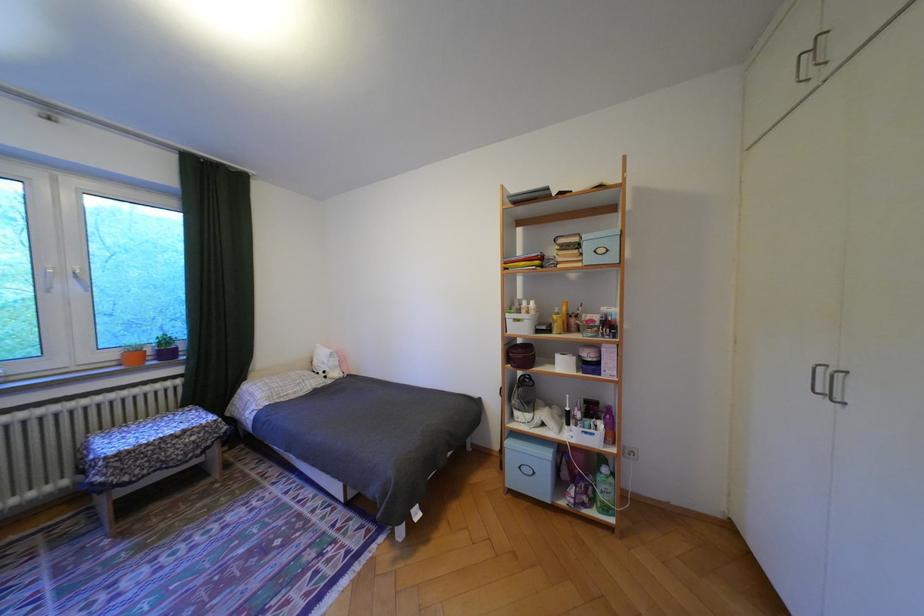
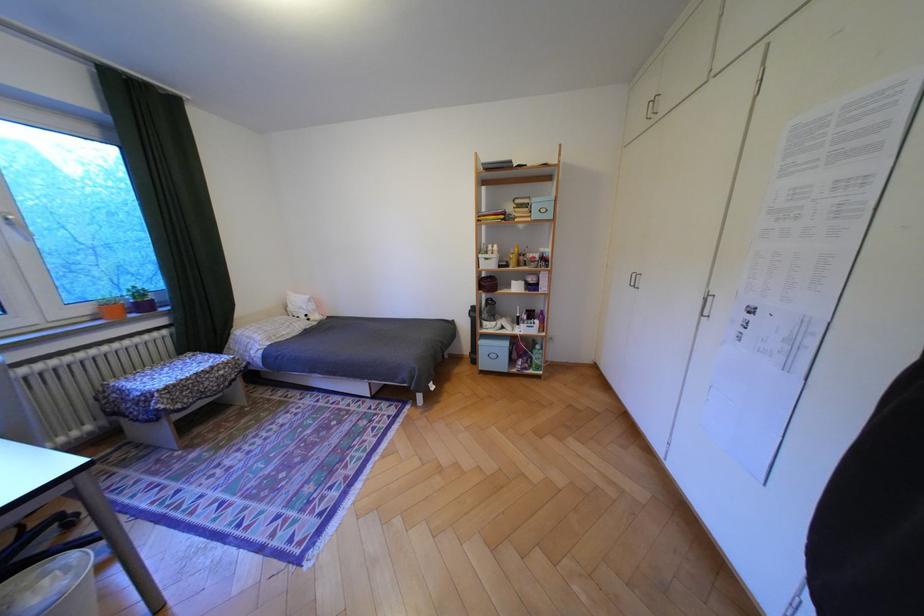
In the second image, find the point that corresponds to point (525, 479) in the first image.

(495, 363)